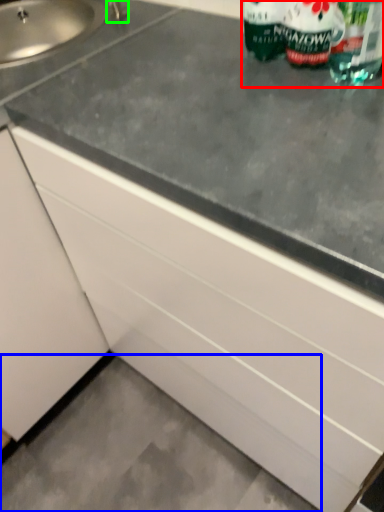
Question: Estimate the real-world distances between objects in this image. Which object is closer to bottle (highlighted by a red box), concrete (highlighted by a blue box) or faucet (highlighted by a green box)?

Choices:
 (A) concrete
 (B) faucet

Answer: (B)